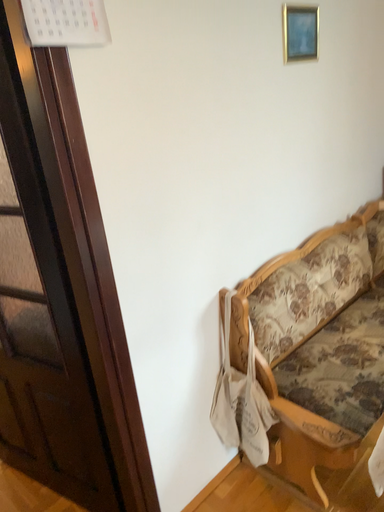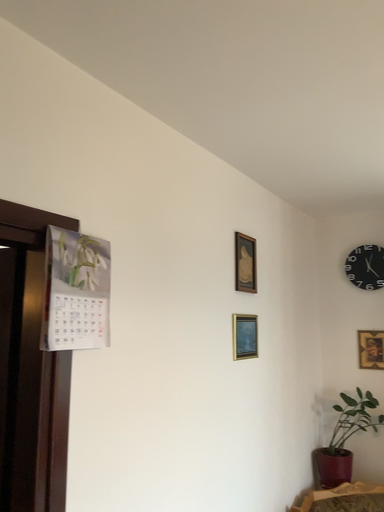
Question: How did the camera likely rotate when shooting the video?

Choices:
 (A) rotated upward
 (B) rotated downward

Answer: (A)